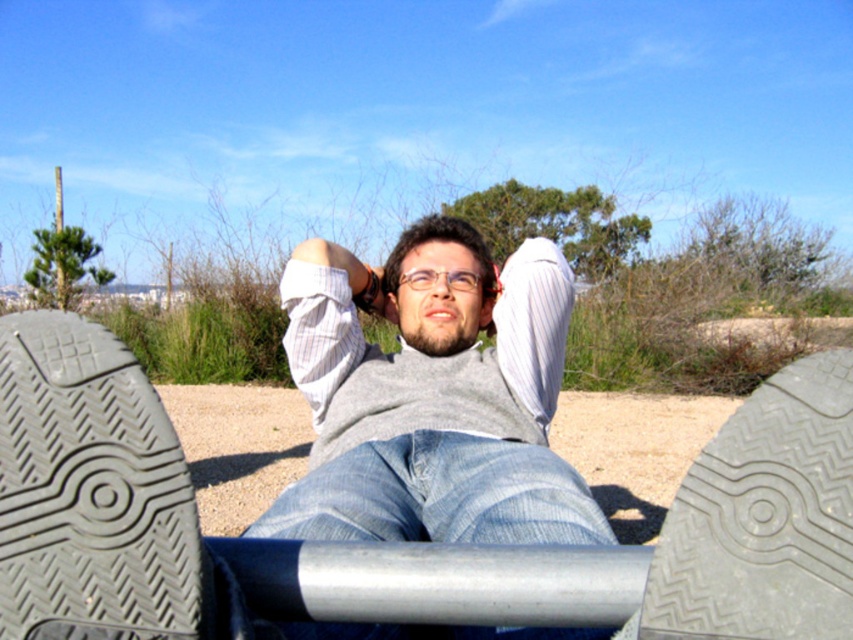
Question: Which object is positioned farthest from the denim at center?

Choices:
 (A) green metallic pole at upper left
 (B) gray rubber shoe at lower center
 (C) gray sweater at center

Answer: (A)

Question: Does black rubber shoe at lower left appear over green metallic pole at upper left?

Choices:
 (A) yes
 (B) no

Answer: (B)

Question: Which is nearer to the light brown sand at center?

Choices:
 (A) black rubber shoe at lower left
 (B) green metallic pole at upper left
 (C) denim at center
 (D) gray sweater at center

Answer: (D)

Question: Can you confirm if denim at center is bigger than green metallic pole at upper left?

Choices:
 (A) no
 (B) yes

Answer: (B)

Question: Which object appears closest to the camera in this image?

Choices:
 (A) light brown sand at center
 (B) gray rubber shoe at lower center

Answer: (B)

Question: Does gray sweater at center come in front of gray rubber shoe at lower center?

Choices:
 (A) yes
 (B) no

Answer: (B)